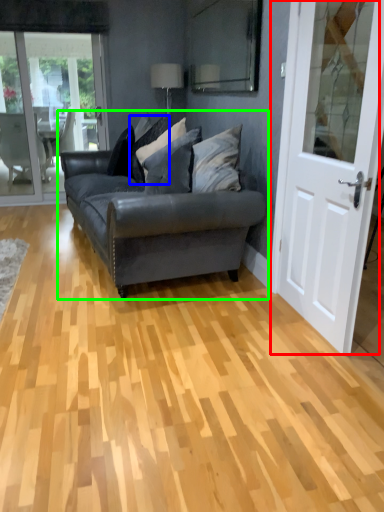
Question: Which is farther away from door (highlighted by a red box)? pillow (highlighted by a blue box) or studio couch (highlighted by a green box)?

Choices:
 (A) pillow
 (B) studio couch

Answer: (A)